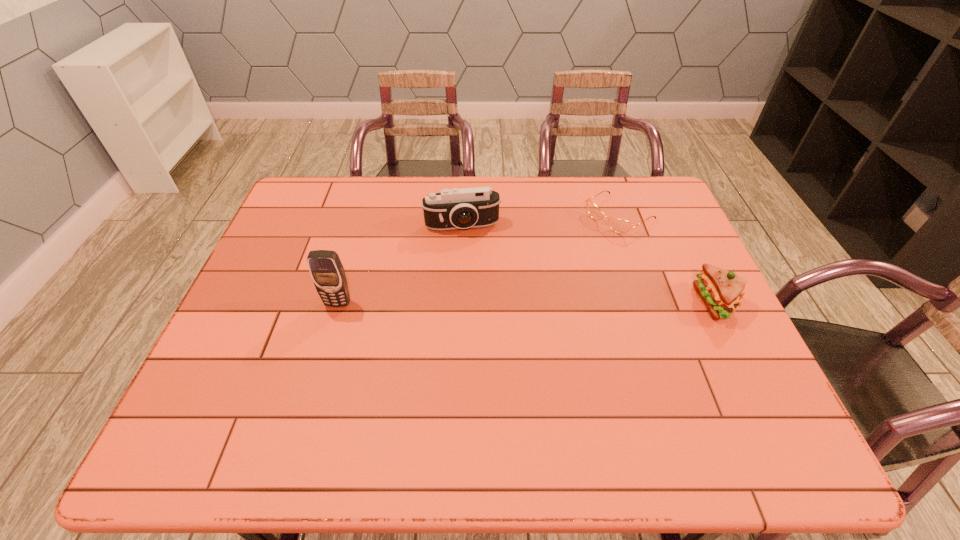
This screenshot has width=960, height=540. Find the location of `free space at the left edge of the desktop`. free space at the left edge of the desktop is located at coordinates click(x=283, y=245).

At what (x,y) coordinates should I click in order to perform the action: click on vacant space at the right edge of the desktop. Please return your answer as a coordinate pair (x, y). Looking at the image, I should click on coord(671,248).

Where is `blank space at the far right corner`? blank space at the far right corner is located at coordinates (672, 205).

Locate an element on the screen. The image size is (960, 540). empty location between the spectacles and the second object from left to right is located at coordinates (540, 221).

At what (x,y) coordinates should I click in order to perform the action: click on blank region between the tallest object and the camera. Please return your answer as a coordinate pair (x, y). This screenshot has height=540, width=960. Looking at the image, I should click on (400, 265).

What are the coordinates of `vacant area between the second object from left to right and the rightmost object` in the screenshot? It's located at (588, 264).

Locate an element on the screen. The image size is (960, 540). vacant area that lies between the tallest object and the sandwich is located at coordinates (527, 303).

What are the coordinates of `vacant area that lies between the spectacles and the leftmost object` in the screenshot? It's located at (479, 259).

Find the location of `unoccupied position between the cellular telephone and the sandwich`. unoccupied position between the cellular telephone and the sandwich is located at coordinates (527, 303).

This screenshot has height=540, width=960. Find the location of `unoccupied area between the camera and the sandwich`. unoccupied area between the camera and the sandwich is located at coordinates (588, 264).